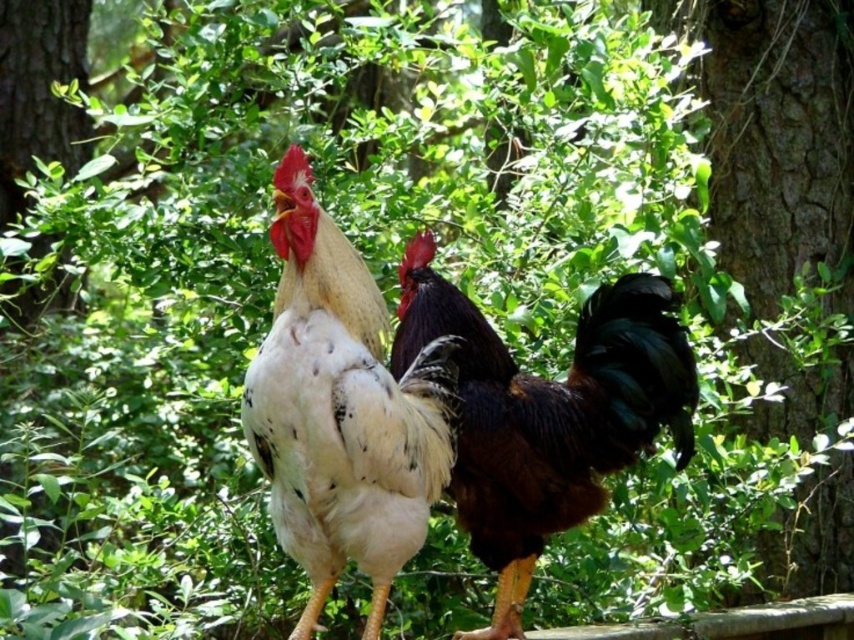
From the picture: You are standing at the center of the image. Which direction should you look to see the rough bark tree at right?

The rough bark tree at right is located at the right side of the image, so you should look to your right to see it.

You are standing in the garden and see the rough bark tree at right and the white speckled feathers at center. Which object is located to the east?

The rough bark tree at right is located to the east of the white speckled feathers at center.

You are a bird watching enthusiast standing in the forest. You see a rough bark tree at right and a shiny black rooster at center. Which object is taller?

The rough bark tree at right is much taller than the shiny black rooster at center.